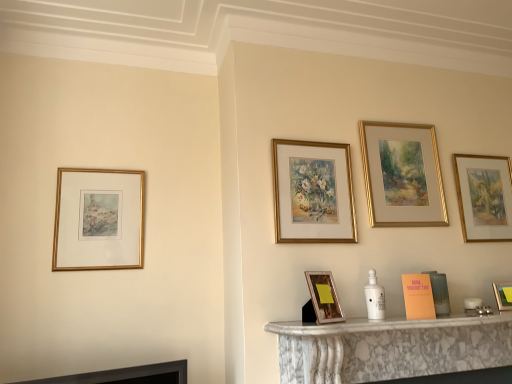
The height and width of the screenshot is (384, 512). What do you see at coordinates (484, 197) in the screenshot?
I see `gold-framed painting at upper right, the sixth picture frame when ordered from left to right` at bounding box center [484, 197].

Identify the location of gold/gilded frame at center, marked as the 3th picture frame in a left-to-right arrangement. This screenshot has width=512, height=384. (313, 192).

Locate an element on the screen. wooden picture frame at lower center, marked as the fifth picture frame in a right-to-left arrangement is located at coordinates (324, 297).

Measure the distance between point [494,284] and camera.

Point [494,284] and camera are 7.05 feet apart from each other.

The width and height of the screenshot is (512, 384). Find the location of `matte gold picture frame at right, acting as the fifth picture frame starting from the left`. matte gold picture frame at right, acting as the fifth picture frame starting from the left is located at coordinates (503, 295).

What do you see at coordinates (418, 296) in the screenshot? I see `orange matte book at lower right` at bounding box center [418, 296].

The image size is (512, 384). What are the coordinates of `gold-framed painting at upper right, the sixth picture frame when ordered from left to right` in the screenshot? It's located at (484, 197).

Is gold-framed painting at upper center, placed as the 3th picture frame when sorted from right to left, turned away from gold framed print at left, placed as the 6th picture frame when sorted from right to left?

No, gold-framed painting at upper center, placed as the 3th picture frame when sorted from right to left,'s orientation is not away from gold framed print at left, placed as the 6th picture frame when sorted from right to left.

Can you confirm if gold-framed painting at upper center, which is the 4th picture frame in left-to-right order, is wider than gold framed print at left, positioned as the first picture frame in left-to-right order?

In fact, gold-framed painting at upper center, which is the 4th picture frame in left-to-right order, might be narrower than gold framed print at left, positioned as the first picture frame in left-to-right order.

From the image's perspective, between gold-framed painting at upper center, which is the 4th picture frame in left-to-right order, and gold framed print at left, placed as the 6th picture frame when sorted from right to left, who is located below?

gold framed print at left, placed as the 6th picture frame when sorted from right to left, is shown below in the image.

Between point (435, 224) and point (106, 259), which one is positioned behind?

Point (435, 224)

From the image's perspective, is orange matte book at lower right positioned above or below matte gold picture frame at right, acting as the fifth picture frame starting from the left?

orange matte book at lower right is above matte gold picture frame at right, acting as the fifth picture frame starting from the left.

Is point (409, 311) closer or farther from the camera than point (505, 295)?

Point (409, 311) is positioned closer to the camera compared to point (505, 295).

Is orange matte book at lower right far away from matte gold picture frame at right, positioned as the 2th picture frame in right-to-left order?

Result: Actually, orange matte book at lower right and matte gold picture frame at right, positioned as the 2th picture frame in right-to-left order, are a little close together.

Considering the relative positions of gold framed print at left, placed as the 6th picture frame when sorted from right to left, and matte gold picture frame at right, positioned as the 2th picture frame in right-to-left order, in the image provided, is gold framed print at left, placed as the 6th picture frame when sorted from right to left, to the left or to the right of matte gold picture frame at right, positioned as the 2th picture frame in right-to-left order,?

From the image, it's evident that gold framed print at left, placed as the 6th picture frame when sorted from right to left, is to the left of matte gold picture frame at right, positioned as the 2th picture frame in right-to-left order.

Between gold framed print at left, positioned as the first picture frame in left-to-right order, and matte gold picture frame at right, positioned as the 2th picture frame in right-to-left order, which one has smaller width?

gold framed print at left, positioned as the first picture frame in left-to-right order, is thinner.

Considering the points (74, 199) and (503, 299), which point is in front, point (74, 199) or point (503, 299)?

The point (74, 199) is in front.

Considering the sizes of gold/gilded frame at center, the fourth picture frame in the right-to-left sequence, and orange matte book at lower right in the image, is gold/gilded frame at center, the fourth picture frame in the right-to-left sequence, wider or thinner than orange matte book at lower right?

Considering their sizes, gold/gilded frame at center, the fourth picture frame in the right-to-left sequence, looks slimmer than orange matte book at lower right.

Between gold/gilded frame at center, the fourth picture frame in the right-to-left sequence, and orange matte book at lower right, which one has more height?

Standing taller between the two is gold/gilded frame at center, the fourth picture frame in the right-to-left sequence.

Is gold/gilded frame at center, marked as the 3th picture frame in a left-to-right arrangement, not near orange matte book at lower right?

No, gold/gilded frame at center, marked as the 3th picture frame in a left-to-right arrangement, is in close proximity to orange matte book at lower right.

What's the angular difference between gold/gilded frame at center, marked as the 3th picture frame in a left-to-right arrangement, and orange matte book at lower right's facing directions?

The angle between the facing direction of gold/gilded frame at center, marked as the 3th picture frame in a left-to-right arrangement, and the facing direction of orange matte book at lower right is 3.01 degrees.

Choose the correct answer: Is gold-framed painting at upper right, which appears as the first picture frame when viewed from the right, inside orange matte book at lower right or outside it?

gold-framed painting at upper right, which appears as the first picture frame when viewed from the right, is located beyond the bounds of orange matte book at lower right.

Considering the sizes of objects gold-framed painting at upper right, the sixth picture frame when ordered from left to right, and orange matte book at lower right in the image provided, who is shorter, gold-framed painting at upper right, the sixth picture frame when ordered from left to right, or orange matte book at lower right?

orange matte book at lower right is shorter.

Does gold-framed painting at upper right, the sixth picture frame when ordered from left to right, have a lesser width compared to orange matte book at lower right?

Indeed, gold-framed painting at upper right, the sixth picture frame when ordered from left to right, has a lesser width compared to orange matte book at lower right.

Does gold-framed painting at upper right, which appears as the first picture frame when viewed from the right, turn towards orange matte book at lower right?

No.

How much distance is there between gold framed print at left, positioned as the first picture frame in left-to-right order, and wooden picture frame at lower center, arranged as the 2th picture frame when viewed from the left?

3.30 feet.

Considering the sizes of gold framed print at left, positioned as the first picture frame in left-to-right order, and wooden picture frame at lower center, arranged as the 2th picture frame when viewed from the left, in the image, is gold framed print at left, positioned as the first picture frame in left-to-right order, bigger or smaller than wooden picture frame at lower center, arranged as the 2th picture frame when viewed from the left,?

Considering their sizes, gold framed print at left, positioned as the first picture frame in left-to-right order, takes up more space than wooden picture frame at lower center, arranged as the 2th picture frame when viewed from the left.

From the image's perspective, which picture frame is the 1st one below the gold framed print at left, placed as the 6th picture frame when sorted from right to left? Please provide its 2D coordinates.

[(324, 297)]

Is gold framed print at left, placed as the 6th picture frame when sorted from right to left, not close to wooden picture frame at lower center, marked as the fifth picture frame in a right-to-left arrangement?

Yes, gold framed print at left, placed as the 6th picture frame when sorted from right to left, and wooden picture frame at lower center, marked as the fifth picture frame in a right-to-left arrangement, are quite far apart.

Between gold-framed painting at upper center, placed as the 3th picture frame when sorted from right to left, and matte gold picture frame at right, positioned as the 2th picture frame in right-to-left order, which one has smaller width?

gold-framed painting at upper center, placed as the 3th picture frame when sorted from right to left, is thinner.

Between gold-framed painting at upper center, placed as the 3th picture frame when sorted from right to left, and matte gold picture frame at right, acting as the fifth picture frame starting from the left, which one appears on the left side from the viewer's perspective?

From the viewer's perspective, gold-framed painting at upper center, placed as the 3th picture frame when sorted from right to left, appears more on the left side.

From a real-world perspective, starting from the gold framed print at left, placed as the 6th picture frame when sorted from right to left, which picture frame is the 3rd one vertically above it? Please provide its 2D coordinates.

[(402, 175)]

This screenshot has width=512, height=384. In the image, there is a matte gold picture frame at right, positioned as the 2th picture frame in right-to-left order. In order to click on book above it (from the image's perspective) in this screenshot , I will do (x=418, y=296).

Which object lies nearer to the anchor point matte gold picture frame at right, positioned as the 2th picture frame in right-to-left order, gold-framed painting at upper center, placed as the 3th picture frame when sorted from right to left, or gold framed print at left, placed as the 6th picture frame when sorted from right to left?

gold-framed painting at upper center, placed as the 3th picture frame when sorted from right to left, is positioned closer to the anchor matte gold picture frame at right, positioned as the 2th picture frame in right-to-left order.

Which object lies nearer to the anchor point orange matte book at lower right, gold-framed painting at upper right, the sixth picture frame when ordered from left to right, or gold/gilded frame at center, marked as the 3th picture frame in a left-to-right arrangement?

Among the two, gold/gilded frame at center, marked as the 3th picture frame in a left-to-right arrangement, is located nearer to orange matte book at lower right.

From the image, which object appears to be nearer to matte gold picture frame at right, positioned as the 2th picture frame in right-to-left order, gold framed print at left, placed as the 6th picture frame when sorted from right to left, or wooden picture frame at lower center, marked as the fifth picture frame in a right-to-left arrangement?

The object closer to matte gold picture frame at right, positioned as the 2th picture frame in right-to-left order, is wooden picture frame at lower center, marked as the fifth picture frame in a right-to-left arrangement.

When comparing their distances from wooden picture frame at lower center, arranged as the 2th picture frame when viewed from the left, does gold/gilded frame at center, marked as the 3th picture frame in a left-to-right arrangement, or orange matte book at lower right seem further?

gold/gilded frame at center, marked as the 3th picture frame in a left-to-right arrangement, is positioned further to the anchor wooden picture frame at lower center, arranged as the 2th picture frame when viewed from the left.

When comparing their distances from gold-framed painting at upper center, which is the 4th picture frame in left-to-right order, does gold framed print at left, positioned as the first picture frame in left-to-right order, or gold-framed painting at upper right, the sixth picture frame when ordered from left to right, seem further?

The object further to gold-framed painting at upper center, which is the 4th picture frame in left-to-right order, is gold framed print at left, positioned as the first picture frame in left-to-right order.

Looking at the image, which one is located further to wooden picture frame at lower center, arranged as the 2th picture frame when viewed from the left, gold-framed painting at upper right, the sixth picture frame when ordered from left to right, or orange matte book at lower right?

gold-framed painting at upper right, the sixth picture frame when ordered from left to right, is positioned further to the anchor wooden picture frame at lower center, arranged as the 2th picture frame when viewed from the left.

Based on their spatial positions, is gold-framed painting at upper center, placed as the 3th picture frame when sorted from right to left, or matte gold picture frame at right, acting as the fifth picture frame starting from the left, closer to wooden picture frame at lower center, arranged as the 2th picture frame when viewed from the left?

Among the two, gold-framed painting at upper center, placed as the 3th picture frame when sorted from right to left, is located nearer to wooden picture frame at lower center, arranged as the 2th picture frame when viewed from the left.

Considering their positions, is gold-framed painting at upper right, the sixth picture frame when ordered from left to right, positioned closer to gold framed print at left, placed as the 6th picture frame when sorted from right to left, than wooden picture frame at lower center, marked as the fifth picture frame in a right-to-left arrangement?

wooden picture frame at lower center, marked as the fifth picture frame in a right-to-left arrangement, is closer to gold framed print at left, placed as the 6th picture frame when sorted from right to left.

This screenshot has height=384, width=512. Find the location of `picture frame between gold/gilded frame at center, marked as the 3th picture frame in a left-to-right arrangement, and matte gold picture frame at right, acting as the fifth picture frame starting from the left, from left to right`. picture frame between gold/gilded frame at center, marked as the 3th picture frame in a left-to-right arrangement, and matte gold picture frame at right, acting as the fifth picture frame starting from the left, from left to right is located at coordinates (402, 175).

This screenshot has height=384, width=512. Identify the location of book situated between gold/gilded frame at center, marked as the 3th picture frame in a left-to-right arrangement, and matte gold picture frame at right, acting as the fifth picture frame starting from the left, from left to right. (418, 296).

You are a GUI agent. You are given a task and a screenshot of the screen. Output one action in this format:
    pyautogui.click(x=<x>, y=<y>)
    Task: Click on the picture frame between wooden picture frame at lower center, arranged as the 2th picture frame when viewed from the left, and gold-framed painting at upper center, placed as the 3th picture frame when sorted from right to left
    The height and width of the screenshot is (384, 512).
    Given the screenshot: What is the action you would take?
    pyautogui.click(x=313, y=192)

At what (x,y) coordinates should I click in order to perform the action: click on book situated between gold framed print at left, placed as the 6th picture frame when sorted from right to left, and matte gold picture frame at right, positioned as the 2th picture frame in right-to-left order, from left to right. Please return your answer as a coordinate pair (x, y). Image resolution: width=512 pixels, height=384 pixels. Looking at the image, I should click on (418, 296).